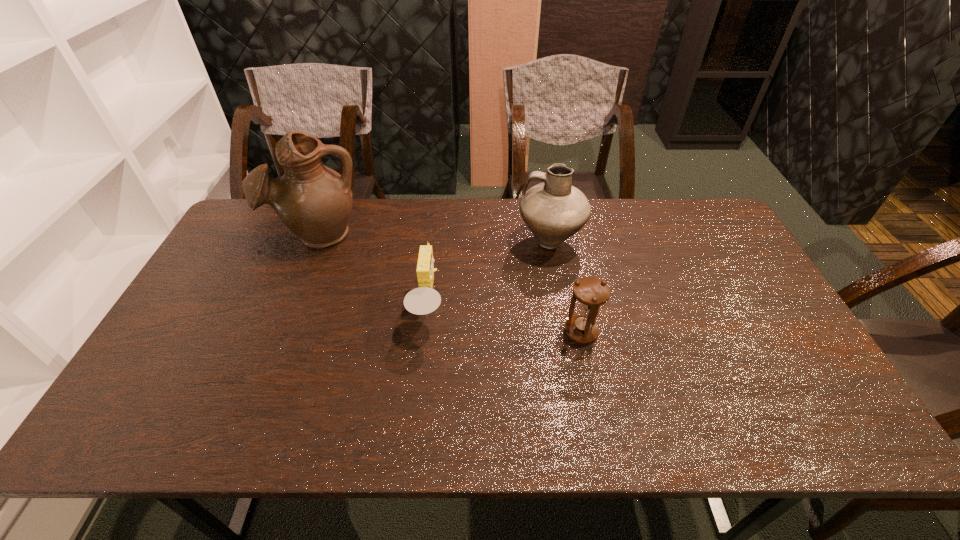
This screenshot has height=540, width=960. I want to click on the second closest object to the shorter pitcher, so click(x=423, y=300).

At what (x,y) coordinates should I click in order to perform the action: click on free space that satisfies the following two spatial constraints: 1. on the back side of the hourglass; 2. on the front-facing side of the second object from left to right. Please return your answer as a coordinate pair (x, y). Looking at the image, I should click on (576, 307).

The height and width of the screenshot is (540, 960). Identify the location of vacant space that satisfies the following two spatial constraints: 1. on the handle side of the right pitcher; 2. on the left side of the hourglass. (565, 332).

This screenshot has width=960, height=540. Find the location of `free space that satisfies the following two spatial constraints: 1. at the spout of the hourglass; 2. on the right side of the left pitcher`. free space that satisfies the following two spatial constraints: 1. at the spout of the hourglass; 2. on the right side of the left pitcher is located at coordinates (278, 332).

The height and width of the screenshot is (540, 960). Find the location of `free space that satisfies the following two spatial constraints: 1. on the front-facing side of the sponge; 2. on the back side of the hourglass`. free space that satisfies the following two spatial constraints: 1. on the front-facing side of the sponge; 2. on the back side of the hourglass is located at coordinates (425, 332).

Where is `blank area in the image that satisfies the following two spatial constraints: 1. at the spout of the hourglass; 2. on the right side of the leftmost object`? Image resolution: width=960 pixels, height=540 pixels. blank area in the image that satisfies the following two spatial constraints: 1. at the spout of the hourglass; 2. on the right side of the leftmost object is located at coordinates (278, 332).

Where is `blank area in the image that satisfies the following two spatial constraints: 1. at the spout of the hourglass; 2. on the left side of the taller pitcher`? This screenshot has height=540, width=960. blank area in the image that satisfies the following two spatial constraints: 1. at the spout of the hourglass; 2. on the left side of the taller pitcher is located at coordinates (278, 332).

The height and width of the screenshot is (540, 960). Find the location of `free location that satisfies the following two spatial constraints: 1. on the back side of the hourglass; 2. on the front-facing side of the sponge`. free location that satisfies the following two spatial constraints: 1. on the back side of the hourglass; 2. on the front-facing side of the sponge is located at coordinates click(x=576, y=307).